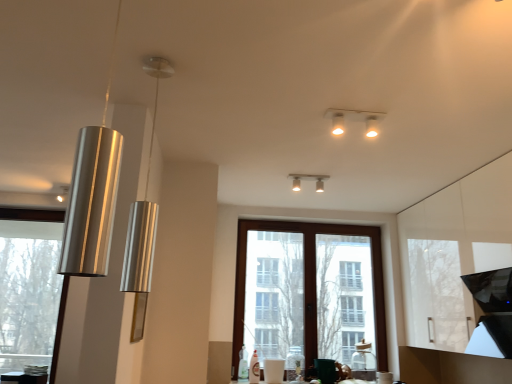
Question: Should I look upward or downward to see silver/metallic pendant light at left, the fourth lamp when ordered from right to left?

Choices:
 (A) down
 (B) up

Answer: (B)

Question: From the image's perspective, is silver/metallic pendant light at left, positioned as the 2th lamp in front-to-back order, beneath metallic cylinder at left, marked as the 1th lamp in a left-to-right arrangement?

Choices:
 (A) no
 (B) yes

Answer: (A)

Question: Is silver/metallic pendant light at left, positioned as the 2th lamp in front-to-back order, taller than metallic cylinder at left, which appears as the first lamp when viewed from the back?

Choices:
 (A) yes
 (B) no

Answer: (A)

Question: Are silver/metallic pendant light at left, which is the 2th lamp from left to right, and metallic cylinder at left, which appears as the 5th lamp when viewed from the right, beside each other?

Choices:
 (A) no
 (B) yes

Answer: (A)

Question: Is silver/metallic pendant light at left, positioned as the 2th lamp in front-to-back order, oriented away from metallic cylinder at left, acting as the fifth lamp starting from the front?

Choices:
 (A) yes
 (B) no

Answer: (B)

Question: Can you confirm if silver/metallic pendant light at left, the fourth lamp when ordered from right to left, is smaller than metallic cylinder at left, which appears as the first lamp when viewed from the back?

Choices:
 (A) no
 (B) yes

Answer: (A)

Question: Can you confirm if silver/metallic pendant light at left, the fourth lamp when ordered from right to left, is wider than metallic cylinder at left, which appears as the 5th lamp when viewed from the right?

Choices:
 (A) no
 (B) yes

Answer: (B)

Question: Would you consider shiny metallic pendant light at left, the fifth lamp when ordered from back to front, to be distant from white glossy light fixture at upper center, acting as the first lamp starting from the right?

Choices:
 (A) yes
 (B) no

Answer: (A)

Question: Is shiny metallic pendant light at left, positioned as the 1th lamp in front-to-back order, outside white glossy light fixture at upper center, placed as the 5th lamp when sorted from left to right?

Choices:
 (A) yes
 (B) no

Answer: (A)

Question: Does shiny metallic pendant light at left, positioned as the 1th lamp in front-to-back order, lie behind white glossy light fixture at upper center, arranged as the third lamp when viewed from the back?

Choices:
 (A) no
 (B) yes

Answer: (A)

Question: Is shiny metallic pendant light at left, the third lamp from the right, in contact with white glossy light fixture at upper center, acting as the first lamp starting from the right?

Choices:
 (A) yes
 (B) no

Answer: (B)

Question: Is shiny metallic pendant light at left, acting as the 3th lamp starting from the left, bigger than white glossy light fixture at upper center, marked as the third lamp in a front-to-back arrangement?

Choices:
 (A) yes
 (B) no

Answer: (A)

Question: Considering the relative sizes of shiny metallic pendant light at left, positioned as the 1th lamp in front-to-back order, and white glossy light fixture at upper center, placed as the 5th lamp when sorted from left to right, in the image provided, is shiny metallic pendant light at left, positioned as the 1th lamp in front-to-back order, shorter than white glossy light fixture at upper center, placed as the 5th lamp when sorted from left to right,?

Choices:
 (A) no
 (B) yes

Answer: (A)

Question: From the image's perspective, is clear glass window at left, which ranks as the second window in right-to-left order, under matte silver light fixture at upper center, which is the 2th lamp from back to front?

Choices:
 (A) yes
 (B) no

Answer: (A)